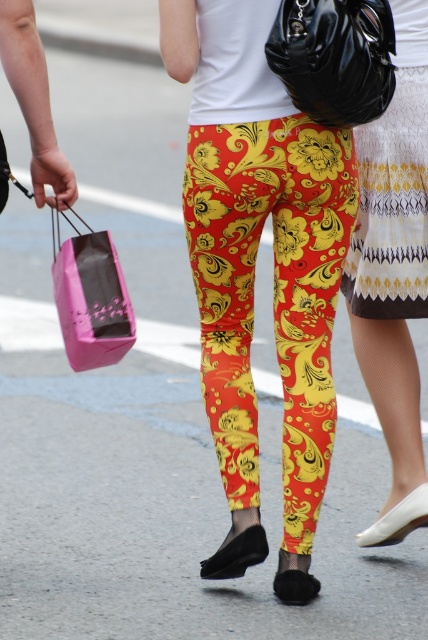
Which is in front, point (406, 304) or point (118, 333)?

Point (118, 333) is more forward.

Does white textured dress at upper right come behind pink paper shopping bag at left?

Yes, it is behind pink paper shopping bag at left.

What do you see at coordinates (392, 209) in the screenshot? The image size is (428, 640). I see `white textured dress at upper right` at bounding box center [392, 209].

Identify the location of white textured dress at upper right. (392, 209).

Who is higher up, printed fabric skirt at center or black leather handbag at upper center?

black leather handbag at upper center is above.

Which of these two, printed fabric skirt at center or black leather handbag at upper center, stands shorter?

Standing shorter between the two is black leather handbag at upper center.

Does point (421, 1) lie behind point (374, 0)?

Yes, it is behind point (374, 0).

This screenshot has width=428, height=640. I want to click on printed fabric skirt at center, so click(394, 273).

Between black leather handbag at upper center and pink paper shopping bag at left, which one has more height?

pink paper shopping bag at left is taller.

Is point (276, 19) closer to camera compared to point (58, 266)?

Yes, point (276, 19) is closer to viewer.

Image resolution: width=428 pixels, height=640 pixels. Identify the location of black leather handbag at upper center. (335, 58).